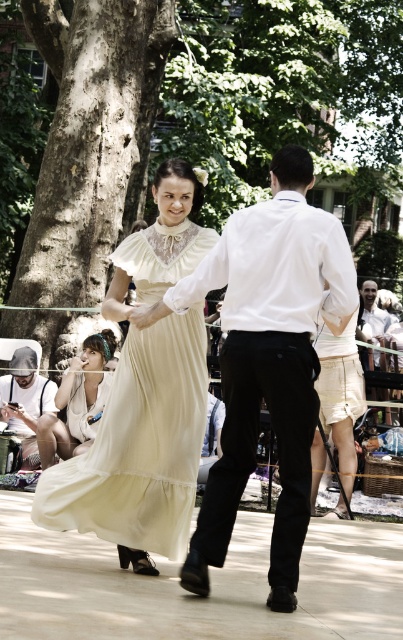
You are a photographer at the event and want to capture a photo of the matte cream dress at center and the denim cap at left. Based on their positions, which object is located to the right of the other?

The matte cream dress at center is positioned on the right side of denim cap at left.

You are a photographer standing in front of the scene. You want to take a photo of the matte cream dress at center and the denim cap at left. Which object should you focus on first to ensure both are in focus?

The matte cream dress at center is closer to the viewer than the denim cap at left, so you should focus on the matte cream dress at center first to ensure both are in focus.